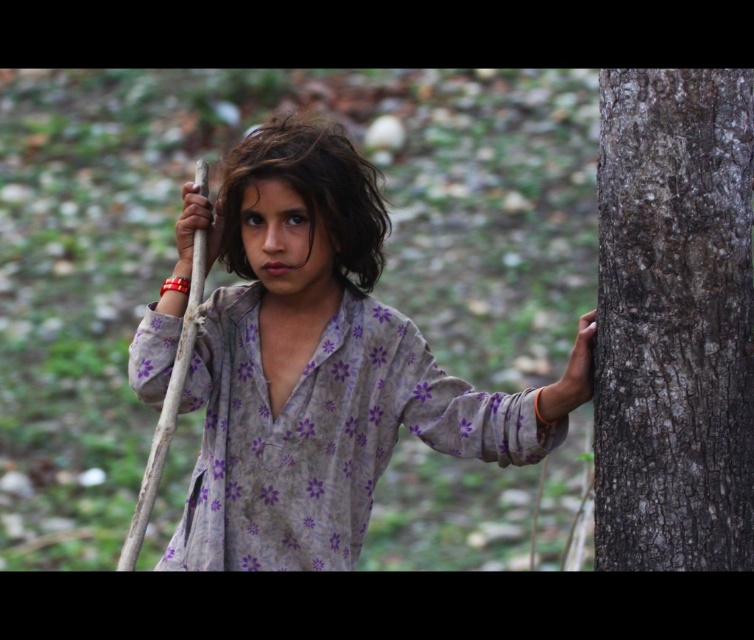
Question: Among these points, which one is nearest to the camera?

Choices:
 (A) (222, 522)
 (B) (694, 515)

Answer: (B)

Question: Is floral-patterned cloth at center below smooth gray bark at right?

Choices:
 (A) yes
 (B) no

Answer: (A)

Question: Does floral-patterned cloth at center have a greater width compared to smooth gray bark at right?

Choices:
 (A) no
 (B) yes

Answer: (B)

Question: Is floral-patterned cloth at center wider than smooth gray bark at right?

Choices:
 (A) no
 (B) yes

Answer: (B)

Question: Which of the following is the farthest from the observer?

Choices:
 (A) (713, 515)
 (B) (379, 468)

Answer: (B)